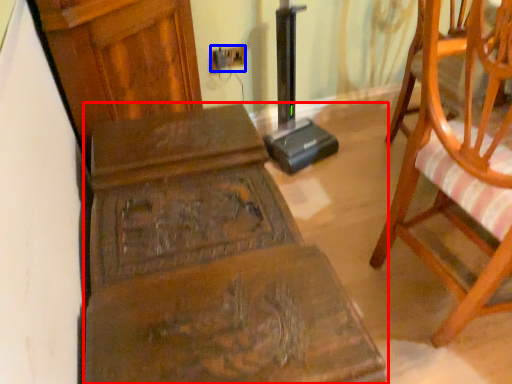
Question: Which of the following is the farthest to the observer, furniture (highlighted by a red box) or electric outlet (highlighted by a blue box)?

Choices:
 (A) furniture
 (B) electric outlet

Answer: (B)